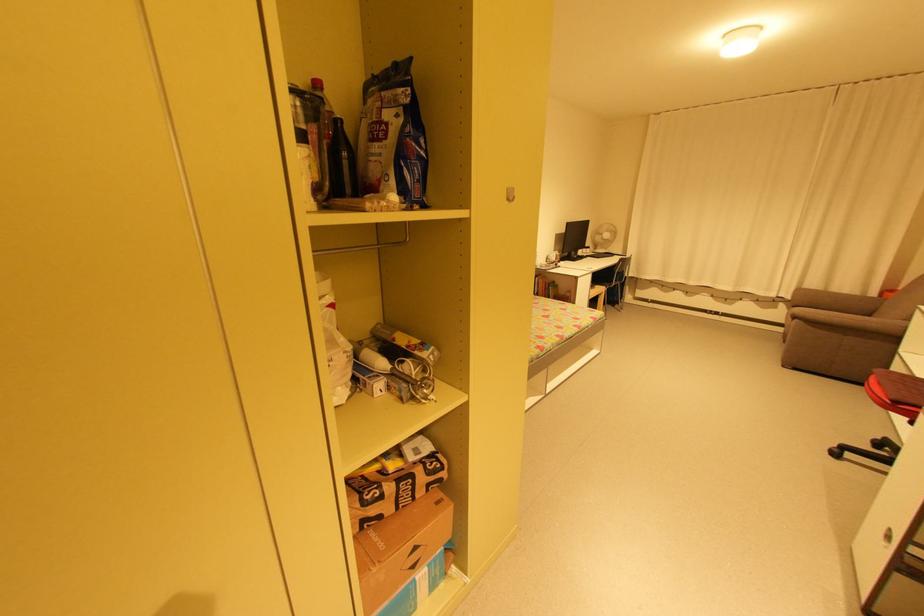
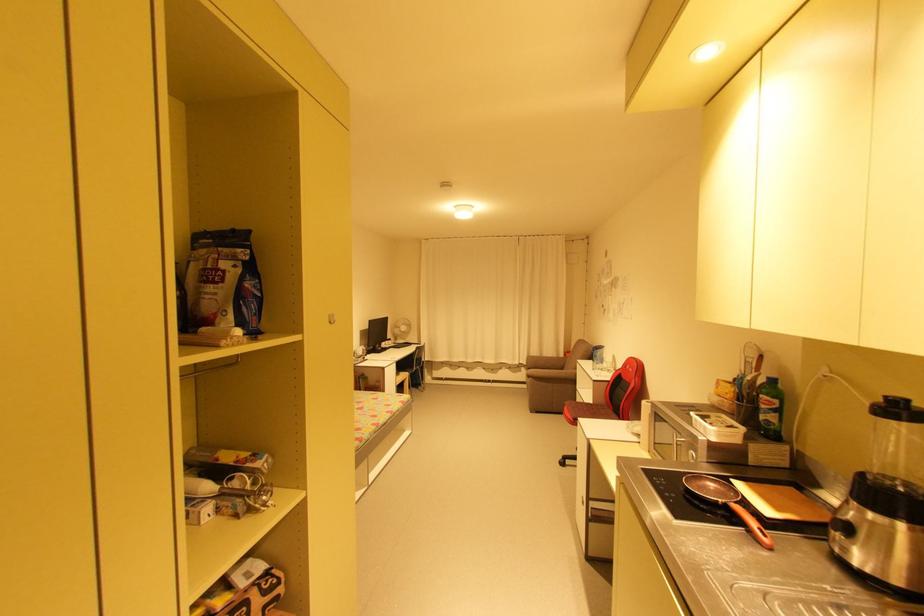
In the second image, find the point that corresponds to [781,309] in the first image.

(525, 371)